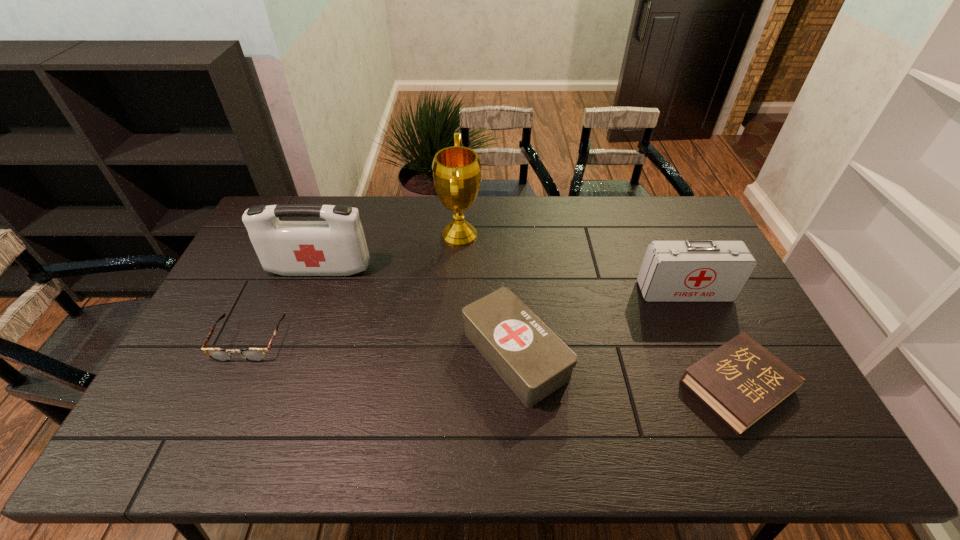
What are the coordinates of `free space between the second farthest first-aid kit and the tallest first-aid kit` in the screenshot? It's located at (502, 280).

I want to click on free spot between the hardback book and the nearest first-aid kit, so click(x=626, y=370).

Identify the location of free space between the second nearest first-aid kit and the hardback book. Image resolution: width=960 pixels, height=540 pixels. (710, 338).

At what (x,y) coordinates should I click in order to perform the action: click on vacant point located between the award and the hardback book. Please return your answer as a coordinate pair (x, y). Looking at the image, I should click on (598, 310).

Where is `free spot between the second farthest first-aid kit and the award`? free spot between the second farthest first-aid kit and the award is located at coordinates (572, 263).

Find the location of a particular element. The width and height of the screenshot is (960, 540). free space between the spectacles and the leftmost first-aid kit is located at coordinates 284,305.

I want to click on object that is the second closest one to the second tallest first-aid kit, so click(534, 362).

Identify which object is located as the nearest to the tallest object. Please provide its 2D coordinates. Your answer should be formatted as a tuple, i.e. [(x, y)], where the tuple contains the x and y coordinates of a point satisfying the conditions above.

[(534, 362)]

Image resolution: width=960 pixels, height=540 pixels. I want to click on the first-aid kit that is the second nearest to the hardback book, so (x=534, y=362).

Locate an element on the screen. The image size is (960, 540). the first-aid kit that can be found as the second closest to the tallest object is located at coordinates (x=336, y=247).